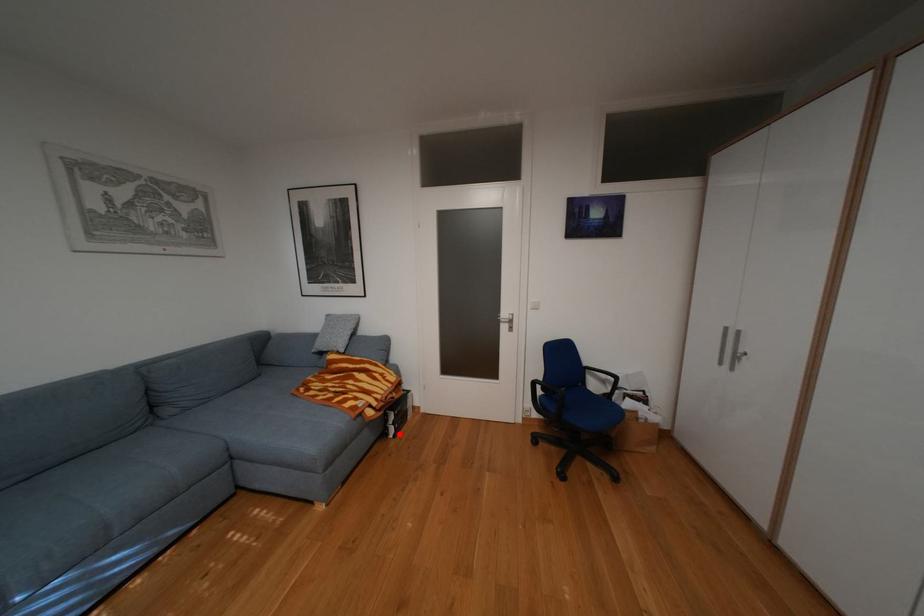
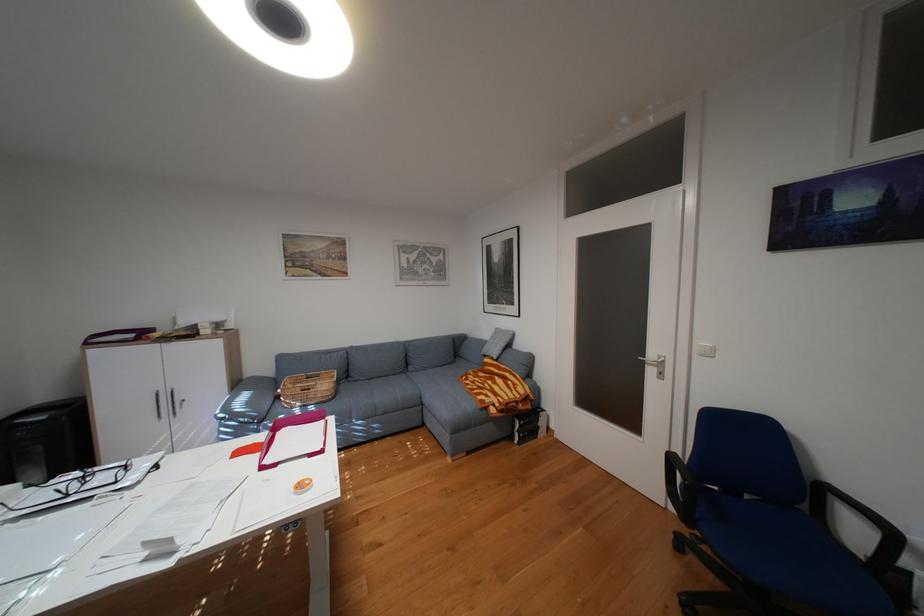
Find the pixel in the second image that matches the highlighted location in the first image.

(526, 438)